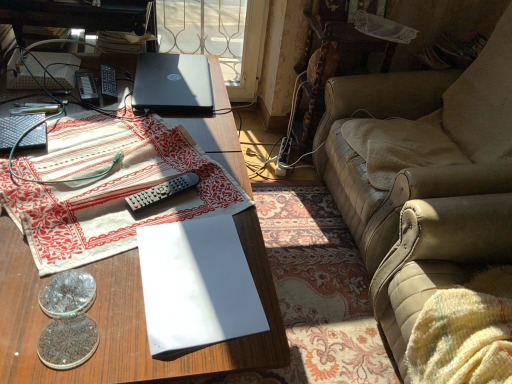
Find the location of `free space between white paper at left, the second paperback book when ordered from right to left, and white paper at center, which is the first paperback book in right-to-left order`. free space between white paper at left, the second paperback book when ordered from right to left, and white paper at center, which is the first paperback book in right-to-left order is located at coordinates (102, 157).